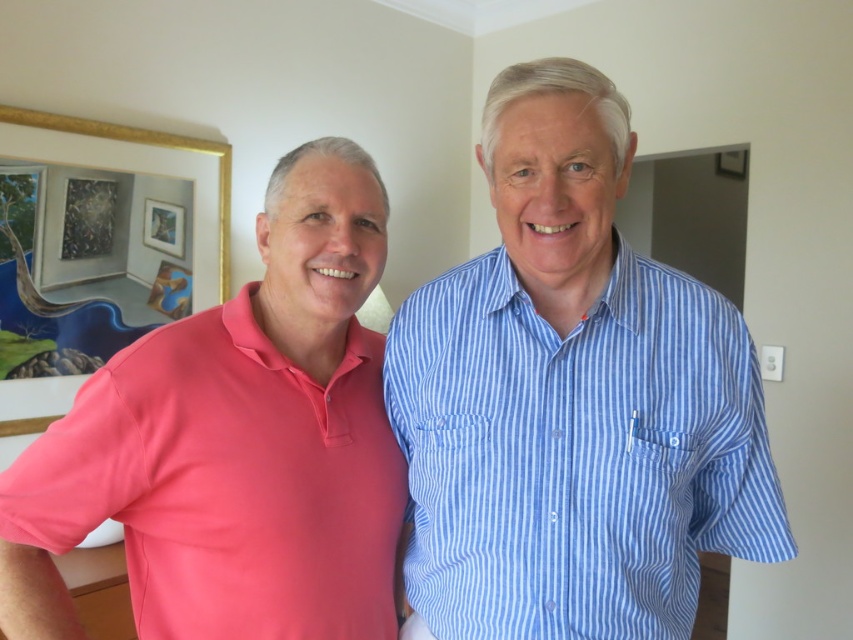
Measure the distance between blue striped shirt at center and gold framed picture at upper left.

A distance of 6.07 feet exists between blue striped shirt at center and gold framed picture at upper left.

From the picture: Can you confirm if blue striped shirt at center is positioned above gold framed picture at upper left?

No.

This screenshot has height=640, width=853. Identify the location of blue striped shirt at center. (576, 452).

This screenshot has width=853, height=640. What are the coordinates of `blue striped shirt at center` in the screenshot? It's located at (576, 452).

Is gold framed picture at upper left further to camera compared to wooden picture frame at upper left?

That is False.

Locate an element on the screen. The width and height of the screenshot is (853, 640). gold framed picture at upper left is located at coordinates (146, 145).

How much distance is there between matte pink polo shirt at left and wooden picture frame at upper left?

matte pink polo shirt at left is 1.62 meters away from wooden picture frame at upper left.

Who is lower down, matte pink polo shirt at left or wooden picture frame at upper left?

matte pink polo shirt at left is lower down.

Is point (352, 360) in front of point (183, 212)?

Yes, it is in front of point (183, 212).

Identify the location of matte pink polo shirt at left. This screenshot has height=640, width=853. (235, 444).